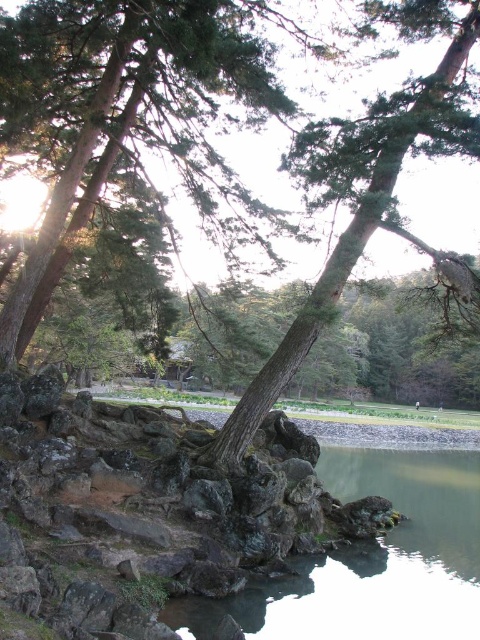
Question: Among these points, which one is nearest to the camera?

Choices:
 (A) (259, 618)
 (B) (402, 140)

Answer: (A)

Question: Which of the following is the closest to the observer?

Choices:
 (A) (336, 284)
 (B) (372, 600)

Answer: (B)

Question: Is the position of smooth gray water at lower center more distant than that of smooth brown tree trunk at center?

Choices:
 (A) no
 (B) yes

Answer: (A)

Question: Where is smooth gray water at lower center located in relation to smooth brown tree trunk at center in the image?

Choices:
 (A) below
 (B) above

Answer: (A)

Question: Which point appears closest to the camera in this image?

Choices:
 (A) (247, 440)
 (B) (320, 596)

Answer: (B)

Question: Observing the image, what is the correct spatial positioning of smooth gray water at lower center in reference to smooth brown tree trunk at center?

Choices:
 (A) right
 (B) left

Answer: (A)